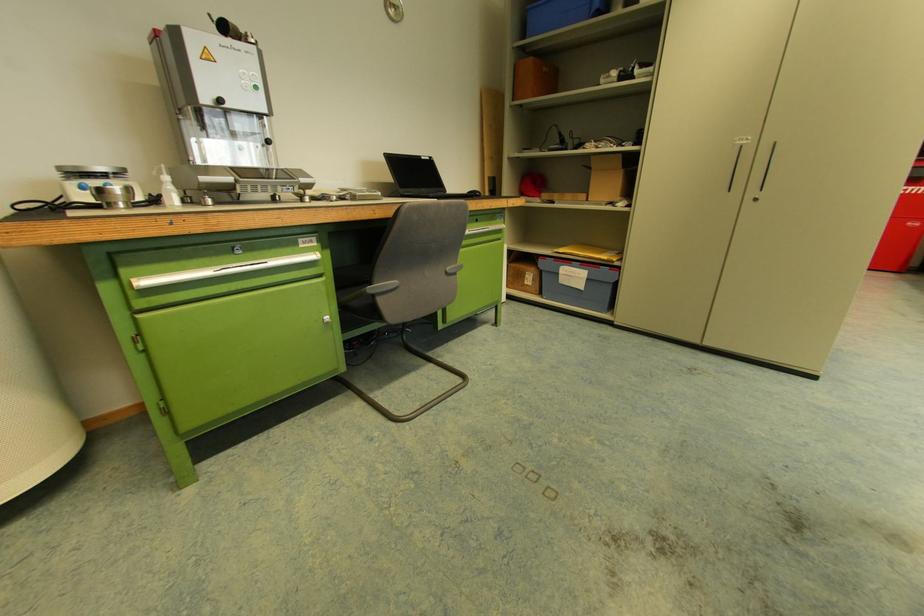
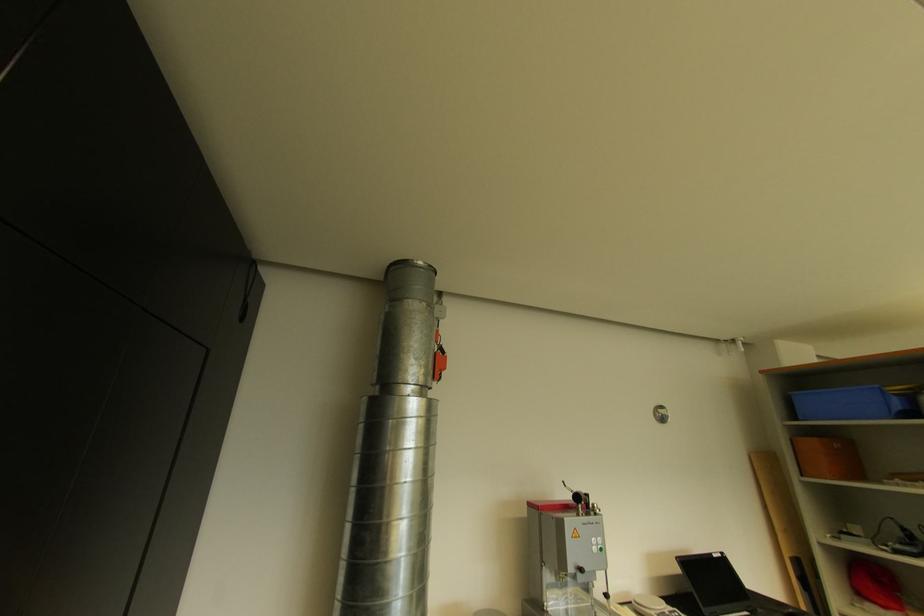
The first image is from the beginning of the video and the second image is from the end. How did the camera likely rotate when shooting the video?

The camera rotated toward left-up.